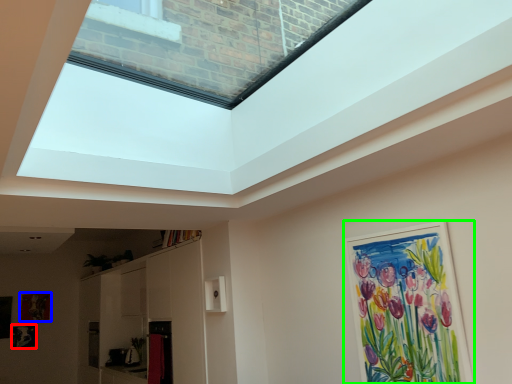
Question: Estimate the real-world distances between objects in this image. Which object is farther from picture frame (highlighted by a red box), picture frame (highlighted by a blue box) or picture frame (highlighted by a green box)?

Choices:
 (A) picture frame
 (B) picture frame

Answer: (B)